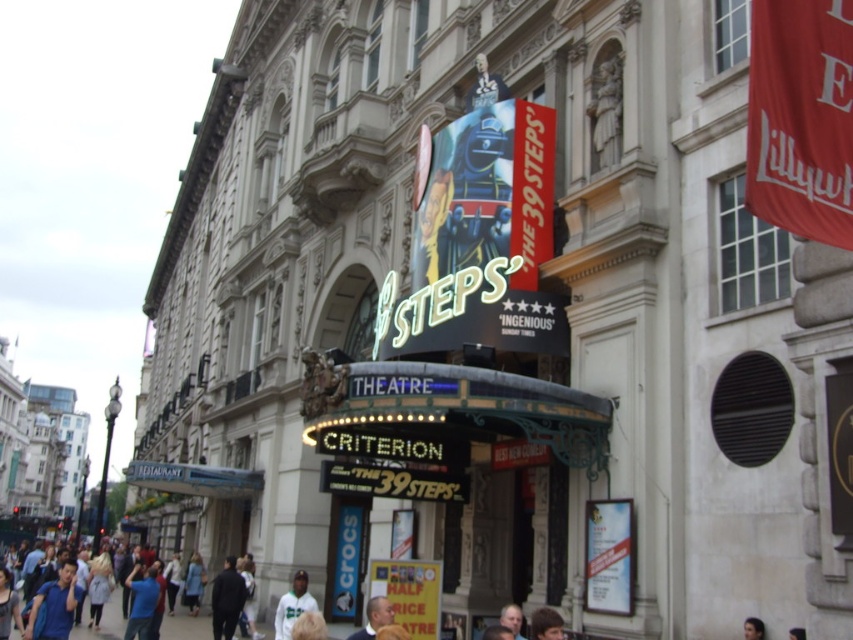
Question: Where is yellow paper sign at lower center located in relation to light brown hair at center in the image?

Choices:
 (A) right
 (B) left

Answer: (A)

Question: Which object is farther from the camera taking this photo?

Choices:
 (A) yellow paper sign at lower center
 (B) dark blue shirt at lower right

Answer: (A)

Question: Does blue denim jacket at lower center appear over light brown hair at center?

Choices:
 (A) no
 (B) yes

Answer: (A)

Question: Which object appears farthest from the camera in this image?

Choices:
 (A) white matte jacket at lower center
 (B) dark blue shirt at center
 (C) dark blue shirt at lower right
 (D) white paper poster at lower right

Answer: (A)

Question: Among these objects, which one is farthest from the camera?

Choices:
 (A) light brown hair at center
 (B) dark blue clothing at lower left
 (C) blue denim jacket at lower center

Answer: (C)

Question: Is dark blue clothing at lower left above dark blue jacket at lower left?

Choices:
 (A) no
 (B) yes

Answer: (A)